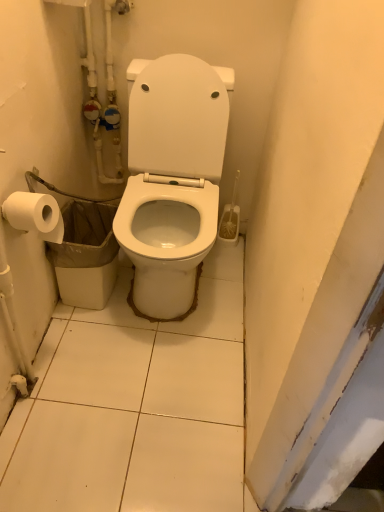
Question: From a real-world perspective, is white plastic trash can at lower left under white glossy toilet at center?

Choices:
 (A) no
 (B) yes

Answer: (B)

Question: Considering the relative sizes of white plastic trash can at lower left and white glossy toilet at center in the image provided, is white plastic trash can at lower left shorter than white glossy toilet at center?

Choices:
 (A) yes
 (B) no

Answer: (A)

Question: Is white plastic trash can at lower left located outside white glossy toilet at center?

Choices:
 (A) yes
 (B) no

Answer: (A)

Question: Does white plastic trash can at lower left have a smaller size compared to white glossy toilet at center?

Choices:
 (A) yes
 (B) no

Answer: (A)

Question: Does white plastic trash can at lower left lie in front of white glossy toilet at center?

Choices:
 (A) no
 (B) yes

Answer: (A)

Question: Does white plastic trash can at lower left appear on the right side of white glossy toilet at center?

Choices:
 (A) yes
 (B) no

Answer: (B)

Question: From a real-world perspective, is white glossy toilet at center physically below white plastic trash can at lower left?

Choices:
 (A) no
 (B) yes

Answer: (A)

Question: Does white glossy toilet at center have a lesser height compared to white plastic trash can at lower left?

Choices:
 (A) yes
 (B) no

Answer: (B)

Question: Is white glossy toilet at center located outside white plastic trash can at lower left?

Choices:
 (A) yes
 (B) no

Answer: (A)

Question: Is the depth of white glossy toilet at center less than that of white plastic trash can at lower left?

Choices:
 (A) yes
 (B) no

Answer: (A)

Question: Considering the relative sizes of white glossy toilet at center and white plastic trash can at lower left in the image provided, is white glossy toilet at center smaller than white plastic trash can at lower left?

Choices:
 (A) yes
 (B) no

Answer: (B)

Question: From the image's perspective, would you say white glossy toilet at center is positioned over white plastic trash can at lower left?

Choices:
 (A) no
 (B) yes

Answer: (B)

Question: Does white glossy toilet at center come in front of white matte toilet paper at left?

Choices:
 (A) yes
 (B) no

Answer: (A)